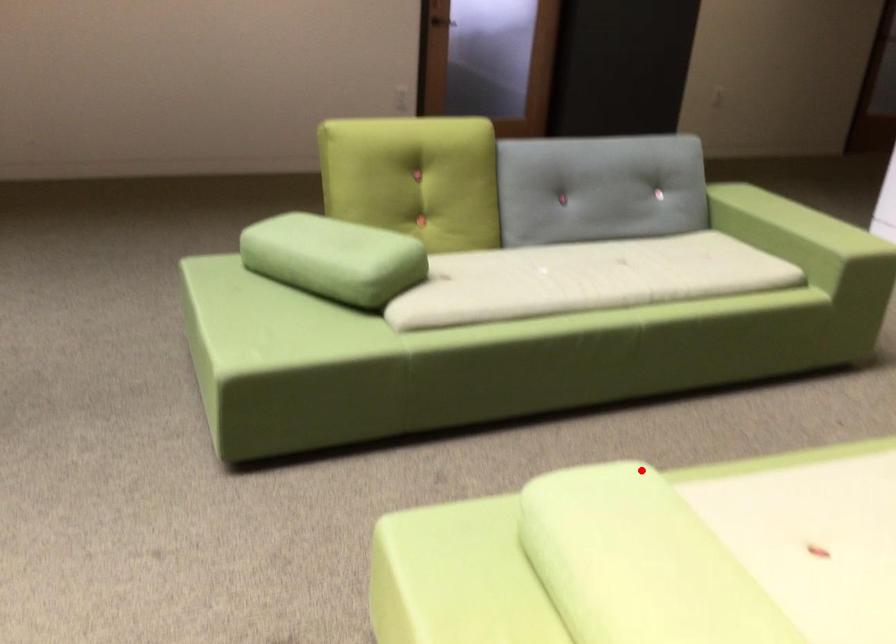
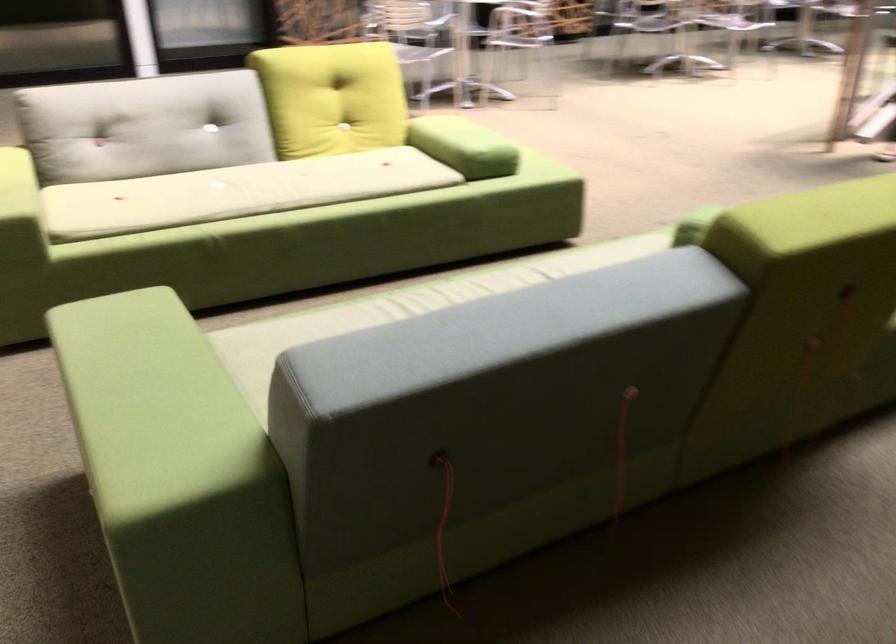
Question: I am providing you with two images of the same scene from different viewpoints. In image1, a red point is highlighted. Considering the same 3D point in image2, which of the following is correct?

Choices:
 (A) It is closer
 (B) It is farther

Answer: (B)